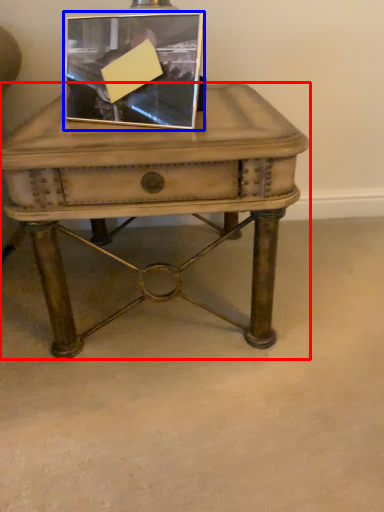
Question: Which of the following is the farthest to the observer, table (highlighted by a red box) or picture frame (highlighted by a blue box)?

Choices:
 (A) table
 (B) picture frame

Answer: (B)